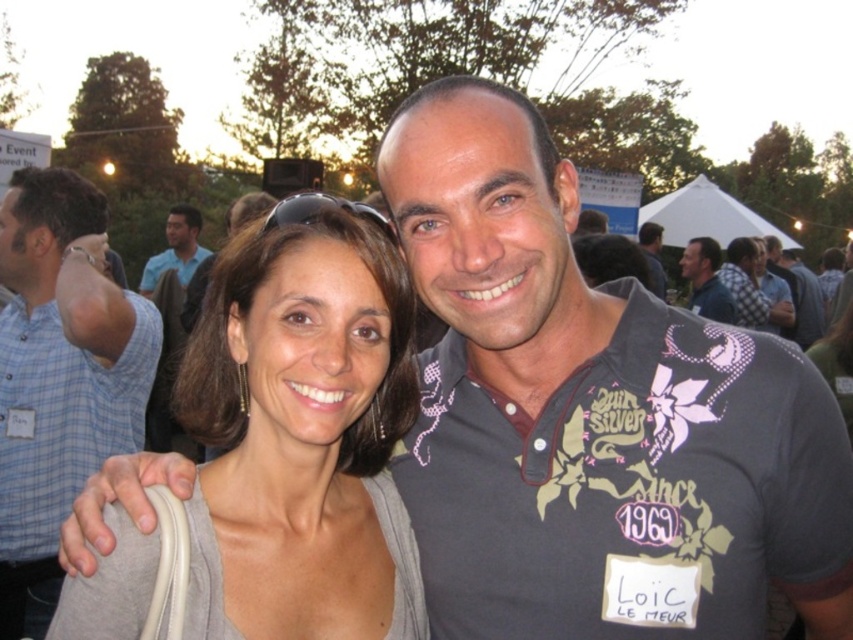
Question: Is gray fabric at center thinner than dark gray shirt at center?

Choices:
 (A) no
 (B) yes

Answer: (B)

Question: Which of the following is the farthest from the observer?

Choices:
 (A) (170, 256)
 (B) (15, 403)
 (C) (688, 244)
 (D) (654, 264)

Answer: (A)

Question: Where is dark blue shirt at center located in relation to matte gray shirt at center in the image?

Choices:
 (A) left
 (B) right

Answer: (B)

Question: Can you confirm if matte gray sweater at center is thinner than blue shirt at upper left?

Choices:
 (A) no
 (B) yes

Answer: (A)

Question: Which point is closer to the camera taking this photo?

Choices:
 (A) (640, 241)
 (B) (218, 333)

Answer: (B)

Question: Which object appears farthest from the camera in this image?

Choices:
 (A) blue shirt at upper left
 (B) blue plaid shirt at left

Answer: (A)